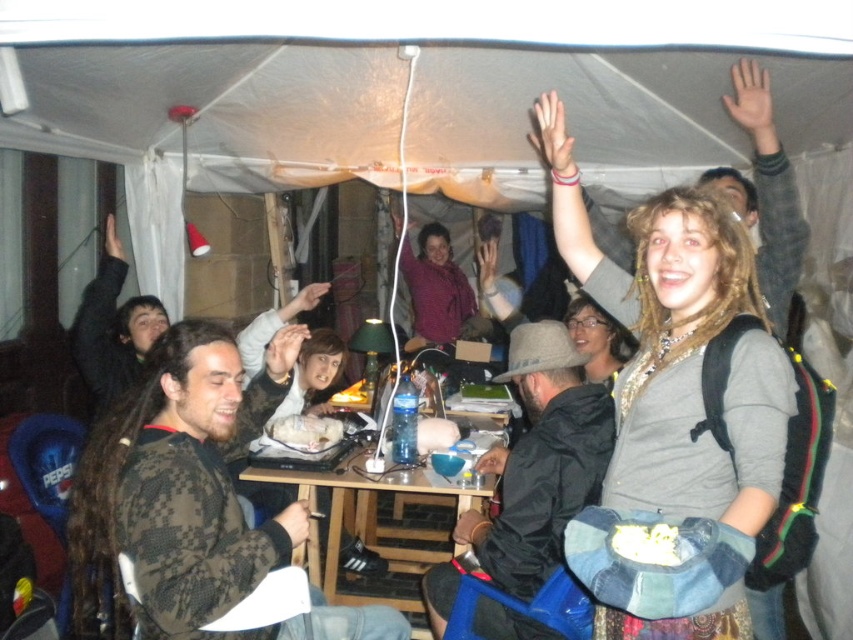
You are standing at the entrance of the tent and want to reach the black matte jacket at center. According to the coordinates provided, in which direction should you move from your current position to locate it?

The black matte jacket at center is located at coordinates point (532, 472), which means it is positioned towards the lower right of the tent. Move towards the lower right direction from your current position to find it.

You are at a party and want to grab the black matte jacket at center. However, there is a matte black hand at lower center in the way. Can you reach the jacket without moving the hand?

The black matte jacket at center is to the right of the matte black hand at lower center, so you can reach it without moving the hand by going around the right side.

You are a photographer trying to capture a candid shot of the scene. Your camera has a minimum focus distance of 40 centimeters. Can you focus on both the black matte jacket at center and the matte black hand at lower center without moving the camera?

The black matte jacket at center is 44.17 centimeters from the matte black hand at lower center. Since the minimum focus distance is 40 centimeters, the camera can focus on both objects as they are within the required distance.